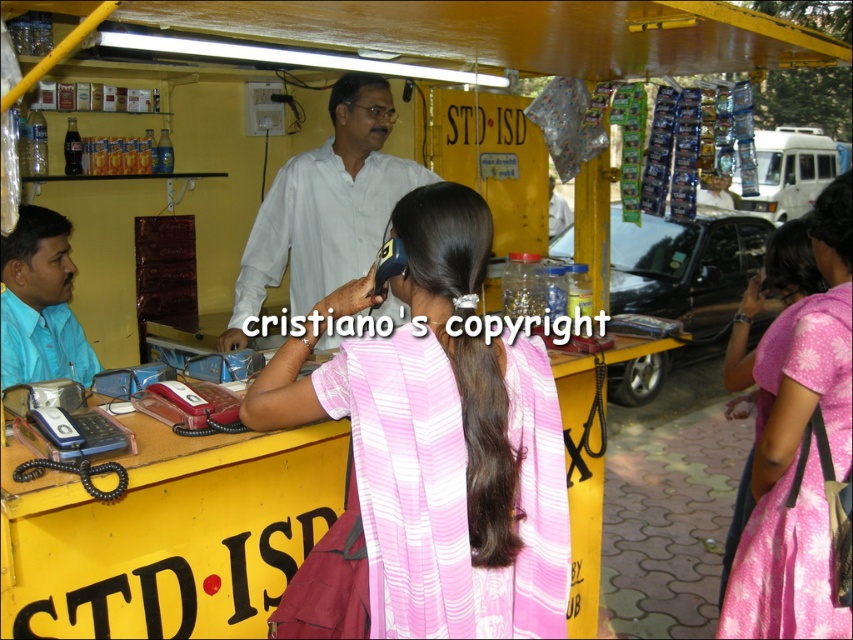
Question: Which is nearer to the pink striped dress at center?

Choices:
 (A) pink satin dress at right
 (B) dark brown silky hair at center

Answer: (B)

Question: Can you confirm if white matte shirt at center is thinner than pink satin dress at right?

Choices:
 (A) no
 (B) yes

Answer: (A)

Question: Which object is the closest to the dark brown silky hair at center?

Choices:
 (A) pink satin dress at right
 (B) white matte shirt at center
 (C) brown matte hair at center
 (D) pink striped dress at center

Answer: (D)

Question: Which of the following is the farthest from the observer?

Choices:
 (A) brown matte hair at center
 (B) brown matte hair at left
 (C) matte blue shirt at left
 (D) pink striped dress at center

Answer: (A)

Question: Is pink striped dress at center to the left of dark brown silky hair at center from the viewer's perspective?

Choices:
 (A) yes
 (B) no

Answer: (A)

Question: Is dark brown silky hair at center thinner than pink satin dress at right?

Choices:
 (A) yes
 (B) no

Answer: (A)